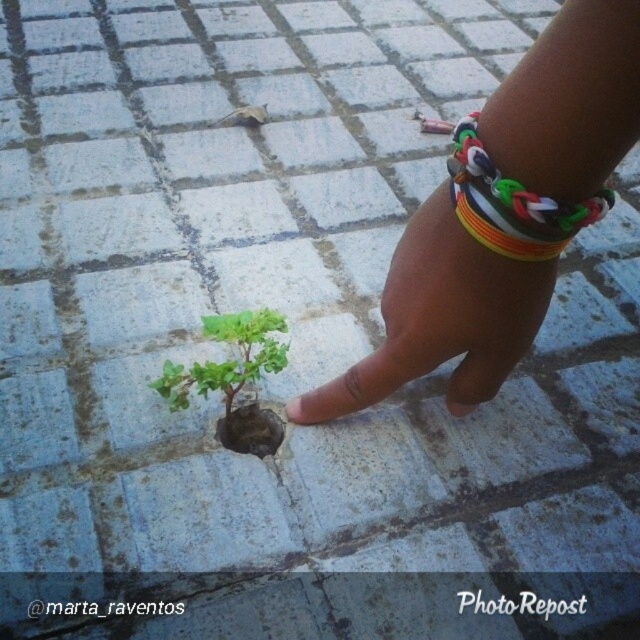
You are a gardener who wants to secure the small plant between the two paving stones. You have a rainbow rubber band at center and a rainbow plastic bracelet at upper right. Which object can you use to secure the plant without damaging it, and why?

The rainbow rubber band at center can be used to secure the plant without damaging it because it has a larger size compared to the rainbow plastic bracelet at upper right, making it more suitable for holding the plant in place gently.